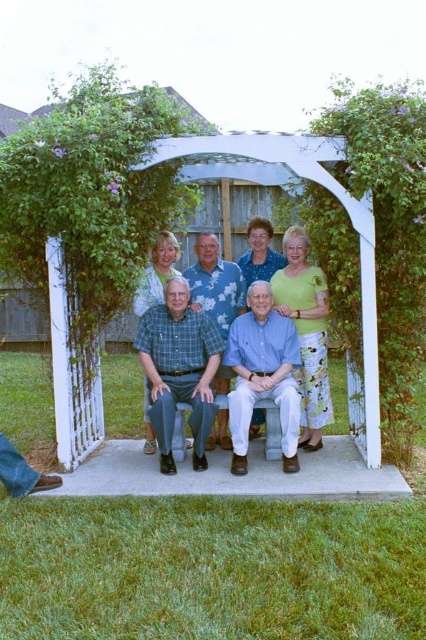
Question: Is green checkered shirt at center positioned behind blue cotton shirt at center?

Choices:
 (A) yes
 (B) no

Answer: (B)

Question: Can you confirm if blue plaid shirt at center is positioned below green checkered shirt at center?

Choices:
 (A) yes
 (B) no

Answer: (B)

Question: Estimate the real-world distances between objects in this image. Which object is farther from the blue cotton shirt at center?

Choices:
 (A) green checkered shirt at center
 (B) blue plaid shirt at center

Answer: (A)

Question: Which point is closer to the camera?

Choices:
 (A) blue plaid shirt at center
 (B) blue cotton shirt at center
 (C) green checkered shirt at center

Answer: (C)

Question: In this image, where is green checkered shirt at center located relative to blue cotton shirt at center?

Choices:
 (A) right
 (B) left

Answer: (B)

Question: Which is nearer to the green checkered shirt at center?

Choices:
 (A) blue cotton shirt at center
 (B) blue plaid shirt at center

Answer: (A)